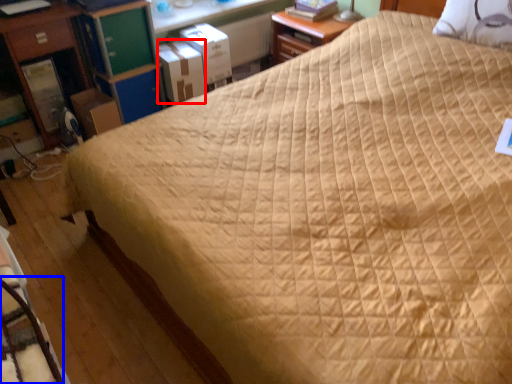
Question: Which point is further to the camera, cardboard box (highlighted by a red box) or rocking chair (highlighted by a blue box)?

Choices:
 (A) cardboard box
 (B) rocking chair

Answer: (A)